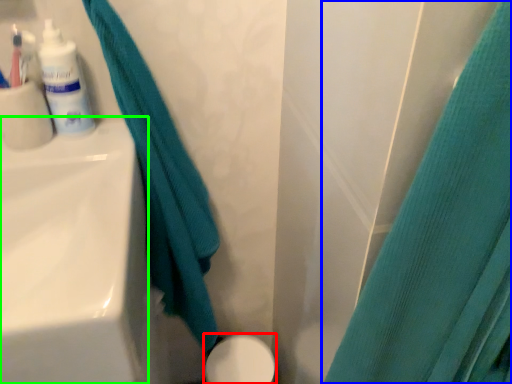
Question: Considering the real-world distances, which object is closest to porcelain (highlighted by a red box)? curtain (highlighted by a blue box) or sink (highlighted by a green box).

Choices:
 (A) curtain
 (B) sink

Answer: (B)